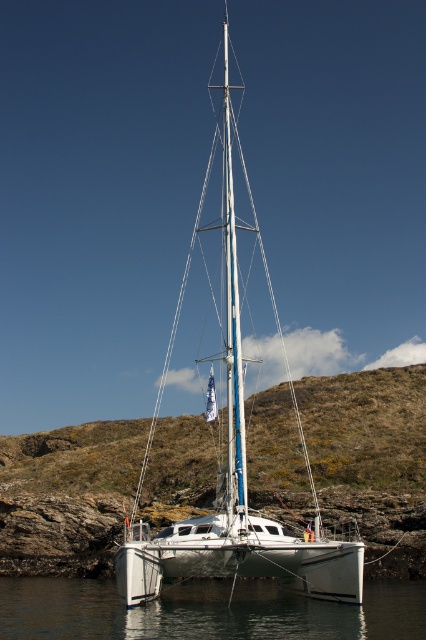
Looking at this image, can you confirm if green grassy hillside at center is positioned above white matte sailboat at center?

Actually, green grassy hillside at center is below white matte sailboat at center.

Who is lower down, green grassy hillside at center or white matte sailboat at center?

Positioned lower is green grassy hillside at center.

The width and height of the screenshot is (426, 640). In order to click on green grassy hillside at center in this screenshot , I will do `click(371, 458)`.

Can you confirm if white matte sailboat at center is taller than clear water at lower center?

Yes.

The width and height of the screenshot is (426, 640). Describe the element at coordinates (236, 481) in the screenshot. I see `white matte sailboat at center` at that location.

Between point (230, 576) and point (325, 632), which one is positioned in front?

Point (325, 632)

This screenshot has height=640, width=426. Find the location of `white matte sailboat at center`. white matte sailboat at center is located at coordinates (236, 481).

Is green grassy hillside at center wider than clear water at lower center?

Yes.

Find the location of `green grassy hillside at center`. green grassy hillside at center is located at coordinates (371, 458).